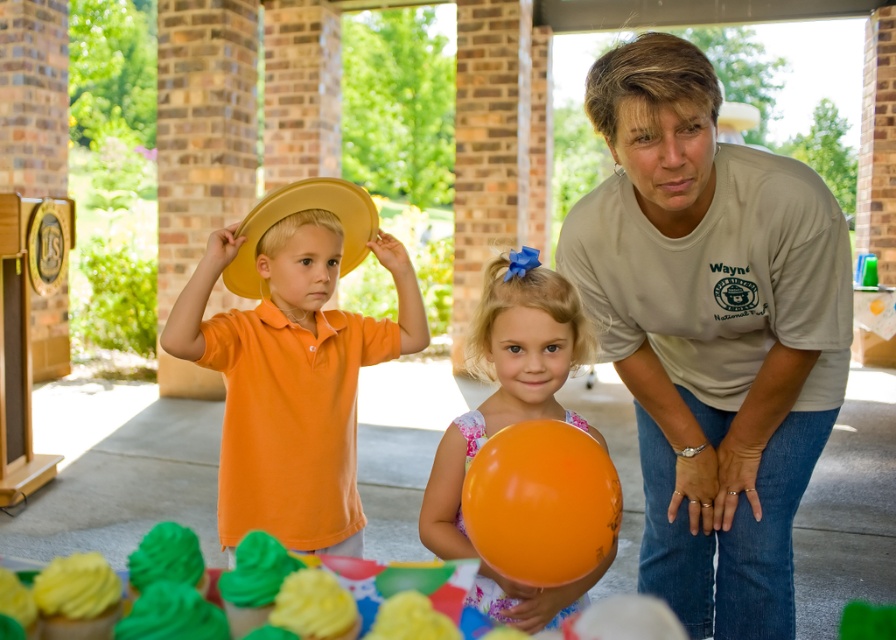
Question: Can you confirm if matte yellow hat at center is wider than yellow frosting cupcake at lower left?

Choices:
 (A) yes
 (B) no

Answer: (A)

Question: Which object is closer to the camera taking this photo?

Choices:
 (A) matte yellow hat at center
 (B) light beige t-shirt at center

Answer: (B)

Question: Based on their relative distances, which object is farther from the yellow straw hat at center?

Choices:
 (A) orange glossy balloon at center
 (B) matte yellow hat at center

Answer: (A)

Question: Does orange glossy balloon at lower center have a greater width compared to yellow straw hat at center?

Choices:
 (A) no
 (B) yes

Answer: (A)

Question: Can you confirm if yellow straw hat at center is smaller than green matte cupcake at lower left?

Choices:
 (A) yes
 (B) no

Answer: (B)

Question: Which object is positioned farthest from the orange glossy balloon at lower center?

Choices:
 (A) yellow frosting cupcake at lower left
 (B) matte yellow hat at center

Answer: (B)